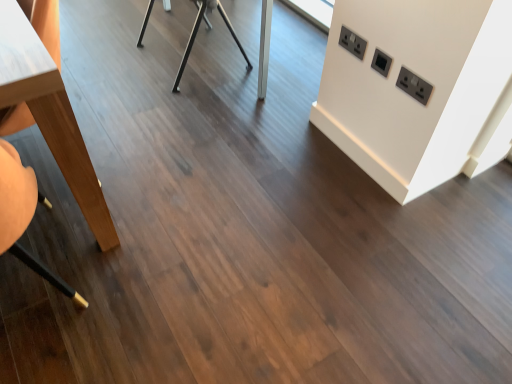
I want to click on vacant area that is situated to the right of metallic silver table at center, placed as the 1th table when sorted from back to front, so click(x=293, y=56).